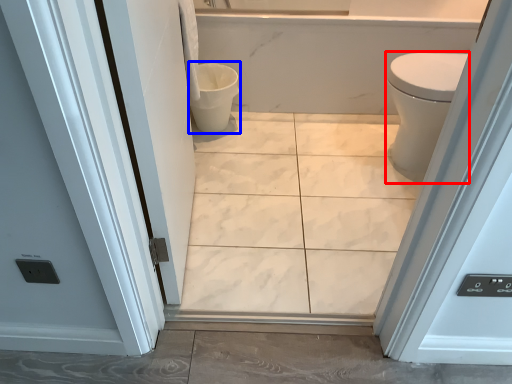
Question: Which of the following is the farthest to the observer, bidet (highlighted by a red box) or toilet bowl (highlighted by a blue box)?

Choices:
 (A) bidet
 (B) toilet bowl

Answer: (B)